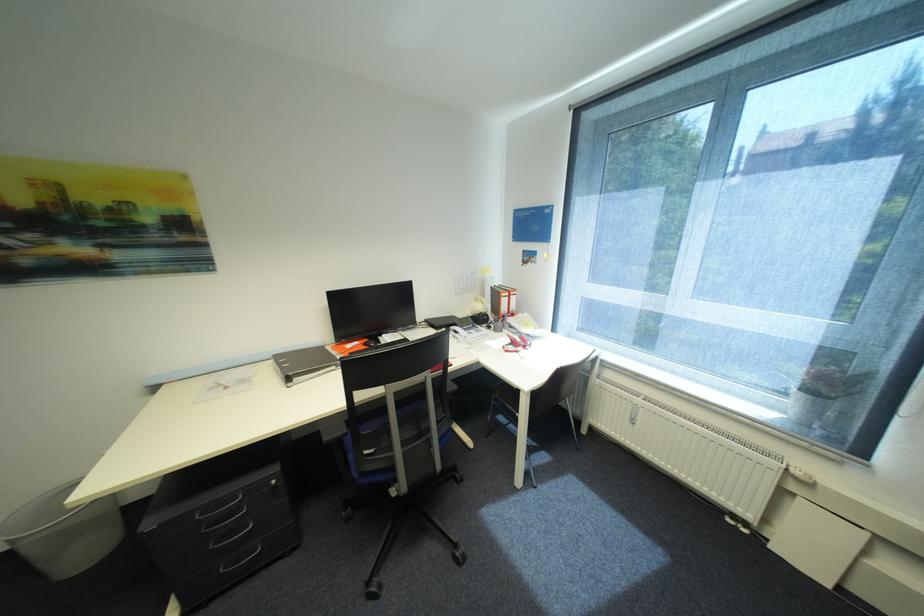
The image size is (924, 616). Identify the location of red telephone handset. (516, 342).